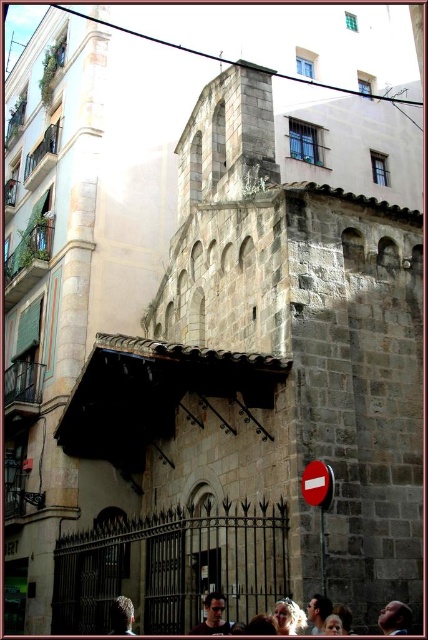
Which is more to the left, smooth skin face at center or dark brown hair at lower left?

dark brown hair at lower left

Who is higher up, smooth skin face at center or dark brown hair at lower left?

smooth skin face at center is higher up.

Describe the element at coordinates (395, 618) in the screenshot. This screenshot has height=640, width=428. I see `smooth skin face at center` at that location.

Identify the location of smooth skin face at center. Image resolution: width=428 pixels, height=640 pixels. pos(395,618).

Is red plastic sign at lower right shorter than smooth brown hair at center?

Yes.

Is point (303, 474) farther from camera compared to point (219, 596)?

Yes, it is behind point (219, 596).

In order to click on red plastic sign at lower right in this screenshot , I will do `click(318, 500)`.

Measure the distance between red plastic sign at lower right and smooth skin face at center.

6.31 meters

Who is more distant from viewer, (305,477) or (391,632)?

The point (305,477) is more distant.

Where is `red plastic sign at lower right`? The image size is (428, 640). red plastic sign at lower right is located at coordinates (318, 500).